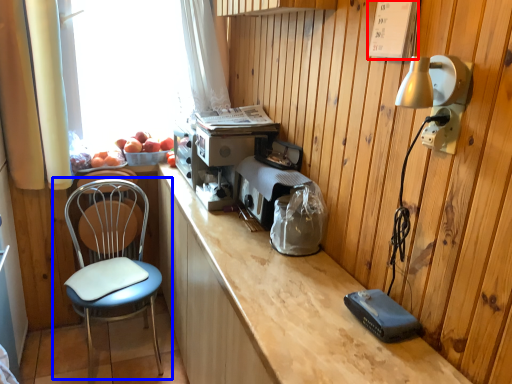
Question: Which of the following is the closest to the observer, panel (highlighted by a red box) or chair (highlighted by a blue box)?

Choices:
 (A) panel
 (B) chair

Answer: (A)